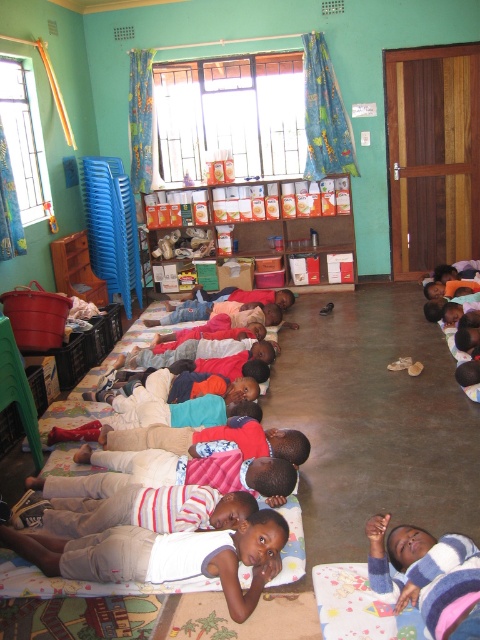
Question: Can you confirm if light brown cotton shorts at center is bigger than striped knit sweater at lower right?

Choices:
 (A) no
 (B) yes

Answer: (B)

Question: Does light brown cotton shorts at center have a larger size compared to striped knit sweater at lower right?

Choices:
 (A) yes
 (B) no

Answer: (A)

Question: Which object is farther from the camera taking this photo?

Choices:
 (A) light brown cotton shorts at center
 (B) striped knit sweater at lower right

Answer: (A)

Question: Which point is farther to the camera?

Choices:
 (A) (190, 557)
 (B) (415, 589)

Answer: (A)

Question: Which object is farther from the camera taking this photo?

Choices:
 (A) striped knit sweater at lower right
 (B) light brown cotton shorts at center

Answer: (B)

Question: Does light brown cotton shorts at center have a lesser width compared to striped knit sweater at lower right?

Choices:
 (A) no
 (B) yes

Answer: (A)